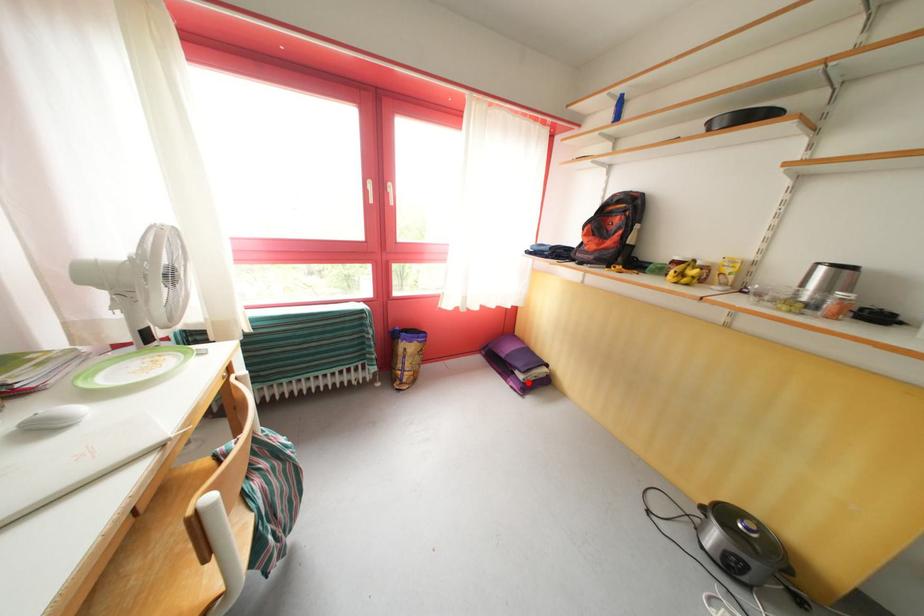
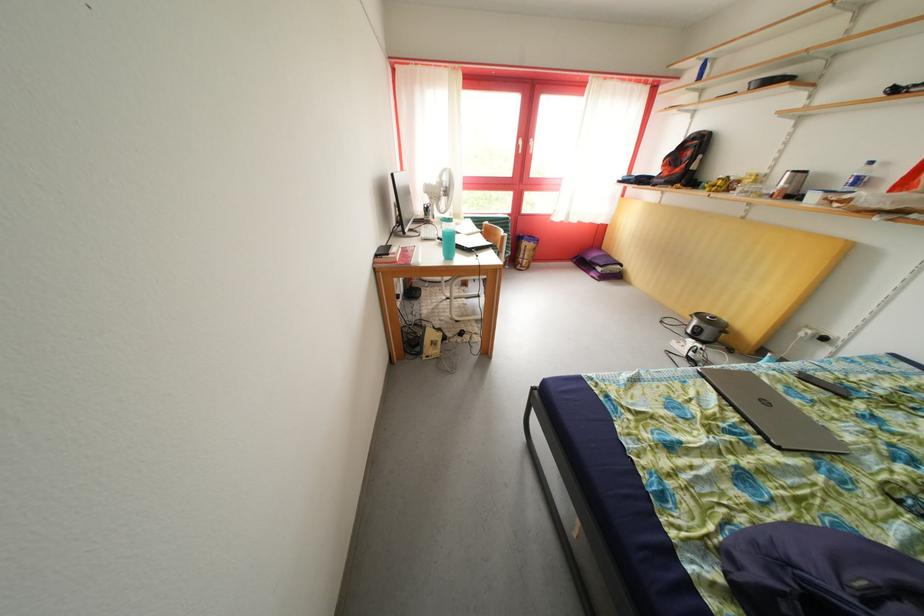
Question: I am providing you with two images of the same scene from different viewpoints. In image1, a red point is highlighted. Considering the same 3D point in image2, which of the following is correct?

Choices:
 (A) It is closer
 (B) It is farther

Answer: (A)